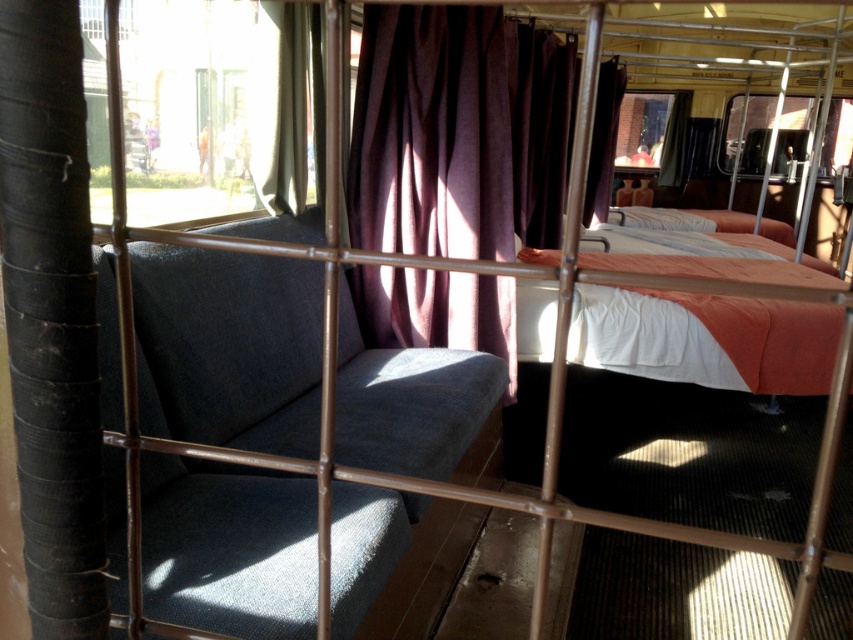
You are a passenger in the vintage train car and want to know if you can stand up fully while sitting on the textured gray couch at left without hitting your head on the purple fabric curtain at center. Can you do that?

The textured gray couch at left is not as tall as the purple fabric curtain at center, so you can stand up fully without hitting your head on the curtain.

You are standing inside the vintage train car and want to reach a small item placed at point (370, 540). If your outstretched hand can reach up to 1.2 meters in front of you, will you be able to reach the item?

The distance of point (370, 540) from viewer is 1.32 meters. Since your hand can only reach up to 1.2 meters, you cannot reach the item.

Consider the image. You are a passenger on this vintage train car and want to access the window to enjoy the view. You see the textured gray couch at left and the matte purple curtain at upper left. Which object must you move past first to reach the window?

You must move past the textured gray couch at left first because it is closer to you than the matte purple curtain at upper left, which is further away.